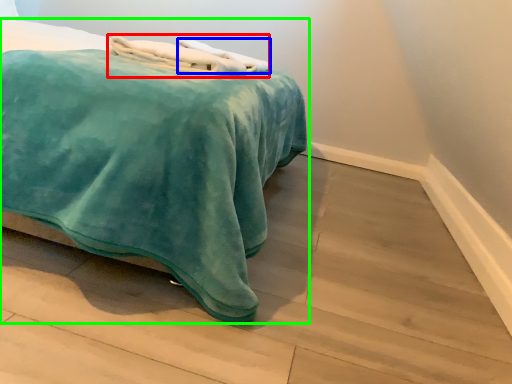
Question: Considering the real-world distances, which object is closest to bath towel (highlighted by a red box)? bath towel (highlighted by a blue box) or bed (highlighted by a green box).

Choices:
 (A) bath towel
 (B) bed

Answer: (A)